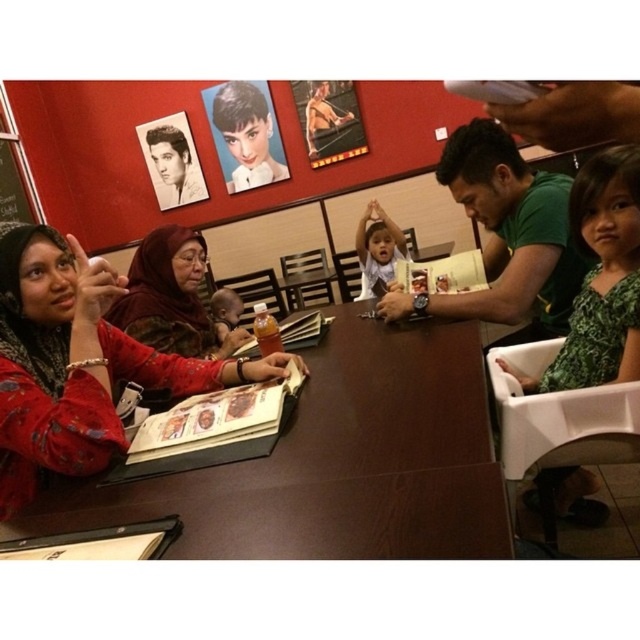
You are a waiter at a restaurant. You need to place a new order of drinks on the table. The drinks must be placed on the right side of the translucent plastic cup at table center. Where should you place the drinks in relation to the brown wooden table at center?

The brown wooden table at center is positioned on the right side of the translucent plastic cup at table center. Therefore, to place the drinks on the right side of the translucent plastic cup at table center, you should place them further to the right of the brown wooden table at center.

You are standing at the entrance of the restaurant and want to find the brown wooden table at center. According to the coordinates provided, where should you look relative to the entrance?

The brown wooden table at center is located at coordinates point (336, 464), so you should look towards the center of the image, slightly to the right and lower middle area from the entrance perspective.